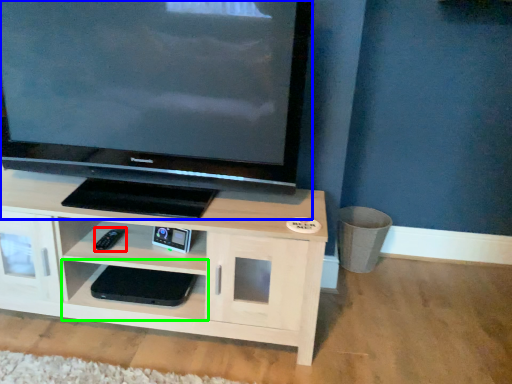
Question: Which is nearer to the remote (highlighted by a red box)? television (highlighted by a blue box) or shelf (highlighted by a green box).

Choices:
 (A) television
 (B) shelf

Answer: (B)